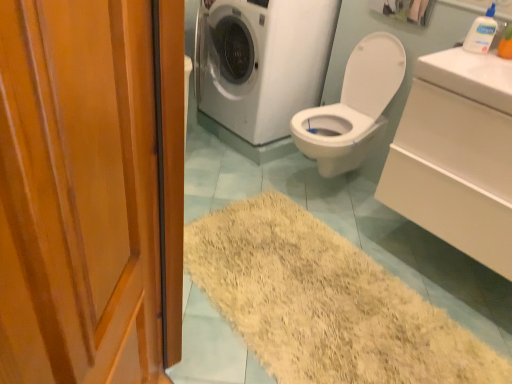
Question: Considering the positions of wooden door at left and white glossy sink at upper right, which is the second counter top in top-to-bottom order, in the image, is wooden door at left taller or shorter than white glossy sink at upper right, which is the second counter top in top-to-bottom order,?

Choices:
 (A) short
 (B) tall

Answer: (B)

Question: In the image, is wooden door at left on the left side or the right side of white glossy sink at upper right, which is the second counter top in top-to-bottom order?

Choices:
 (A) left
 (B) right

Answer: (A)

Question: Which of these objects is positioned farthest from the white glossy toilet at center?

Choices:
 (A) white paper towel at upper center
 (B) white glossy sink at upper right, which is the second counter top in top-to-bottom order
 (C) white glossy washing machine at upper center
 (D) clear plastic bottle at upper right
 (E) wooden door at left

Answer: (E)

Question: Considering the real-world distances, which object is closest to the wooden door at left?

Choices:
 (A) white glossy washing machine at upper center
 (B) white glossy sink at upper right, which is the second counter top in top-to-bottom order
 (C) white paper towel at upper center
 (D) clear plastic bottle at upper right
 (E) white glossy toilet at center

Answer: (B)